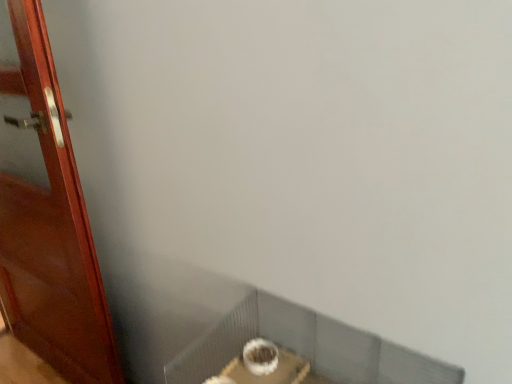
Question: In the image, is white textured tile at upper center on the left side or the right side of wooden door at left?

Choices:
 (A) right
 (B) left

Answer: (A)

Question: From the image's perspective, is white textured tile at upper center above or below wooden door at left?

Choices:
 (A) above
 (B) below

Answer: (B)

Question: Is white textured tile at upper center wider or thinner than wooden door at left?

Choices:
 (A) thin
 (B) wide

Answer: (B)

Question: Is point (24, 258) closer or farther from the camera than point (262, 321)?

Choices:
 (A) farther
 (B) closer

Answer: (A)

Question: Is wooden door at left taller or shorter than white textured tile at upper center?

Choices:
 (A) short
 (B) tall

Answer: (B)

Question: From a real-world perspective, relative to white textured tile at upper center, is wooden door at left vertically above or below?

Choices:
 (A) above
 (B) below

Answer: (A)

Question: Considering the relative positions of wooden door at left and white textured tile at upper center in the image provided, is wooden door at left to the left or to the right of white textured tile at upper center?

Choices:
 (A) left
 (B) right

Answer: (A)